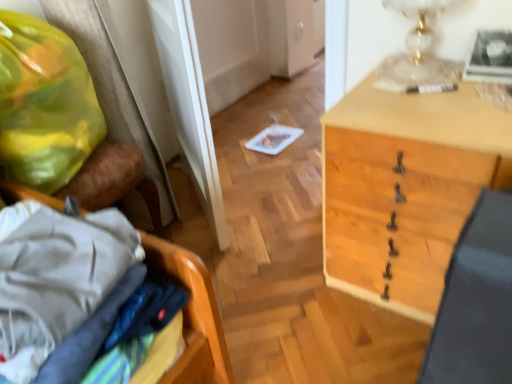
Question: Is white glass table lamp at upper right in front of wooden desk at center?

Choices:
 (A) no
 (B) yes

Answer: (A)

Question: Can you confirm if white glass table lamp at upper right is wider than wooden desk at center?

Choices:
 (A) no
 (B) yes

Answer: (A)

Question: Considering the relative sizes of white glass table lamp at upper right and wooden desk at center in the image provided, is white glass table lamp at upper right thinner than wooden desk at center?

Choices:
 (A) yes
 (B) no

Answer: (A)

Question: From the image's perspective, does white glass table lamp at upper right appear higher than wooden desk at center?

Choices:
 (A) yes
 (B) no

Answer: (A)

Question: Is white glass table lamp at upper right to the right of wooden desk at center from the viewer's perspective?

Choices:
 (A) no
 (B) yes

Answer: (A)

Question: Is white glass table lamp at upper right touching wooden desk at center?

Choices:
 (A) no
 (B) yes

Answer: (A)

Question: Is white glass table lamp at upper right smaller than wooden laundry basket at left?

Choices:
 (A) no
 (B) yes

Answer: (B)

Question: Are white glass table lamp at upper right and wooden laundry basket at left far apart?

Choices:
 (A) no
 (B) yes

Answer: (A)

Question: Considering the relative positions of white glass table lamp at upper right and wooden laundry basket at left in the image provided, is white glass table lamp at upper right to the right of wooden laundry basket at left from the viewer's perspective?

Choices:
 (A) yes
 (B) no

Answer: (A)

Question: Is white glass table lamp at upper right positioned with its back to wooden laundry basket at left?

Choices:
 (A) no
 (B) yes

Answer: (A)

Question: From the image's perspective, does white glass table lamp at upper right appear lower than wooden laundry basket at left?

Choices:
 (A) no
 (B) yes

Answer: (A)

Question: Is white glass table lamp at upper right touching wooden laundry basket at left?

Choices:
 (A) yes
 (B) no

Answer: (B)

Question: From a real-world perspective, is white glass table lamp at upper right below yellow plastic bag at left?

Choices:
 (A) yes
 (B) no

Answer: (B)